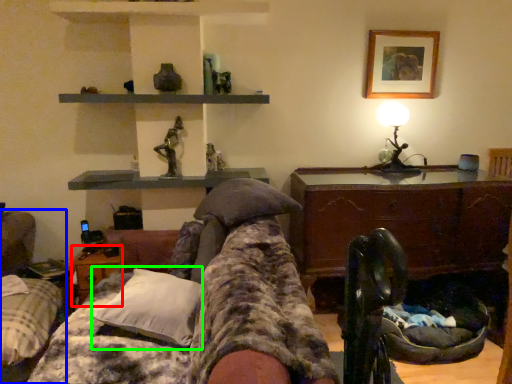
Question: Considering the real-world distances, which object is closest to table (highlighted by a red box)? furniture (highlighted by a blue box) or pillow (highlighted by a green box).

Choices:
 (A) furniture
 (B) pillow

Answer: (A)